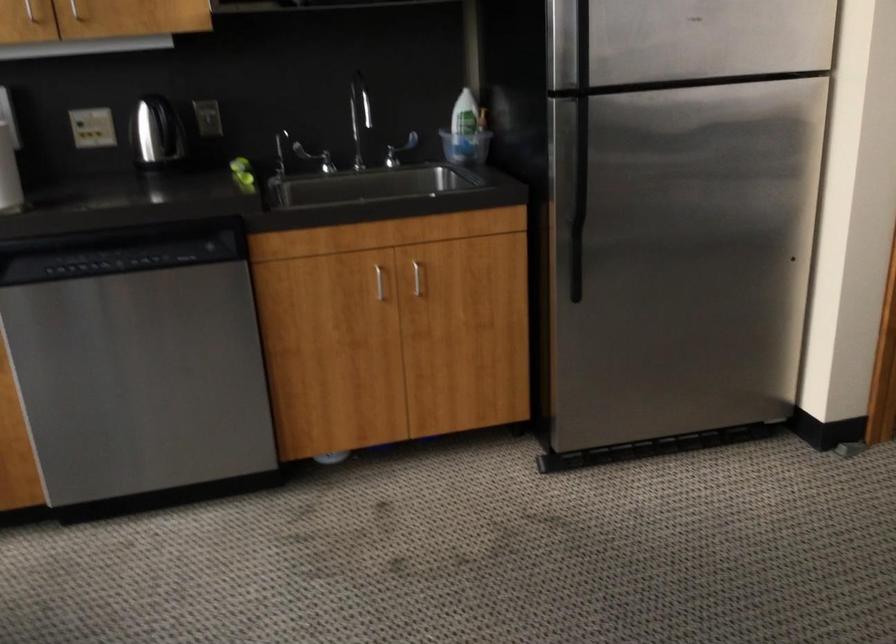
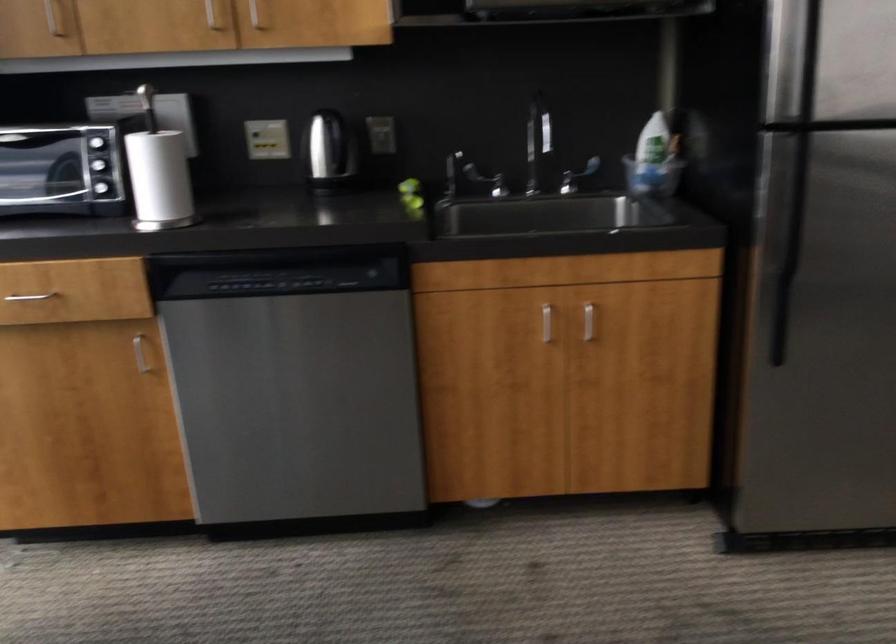
In the second image, find the point that corresponds to [460,128] in the first image.

(650, 155)